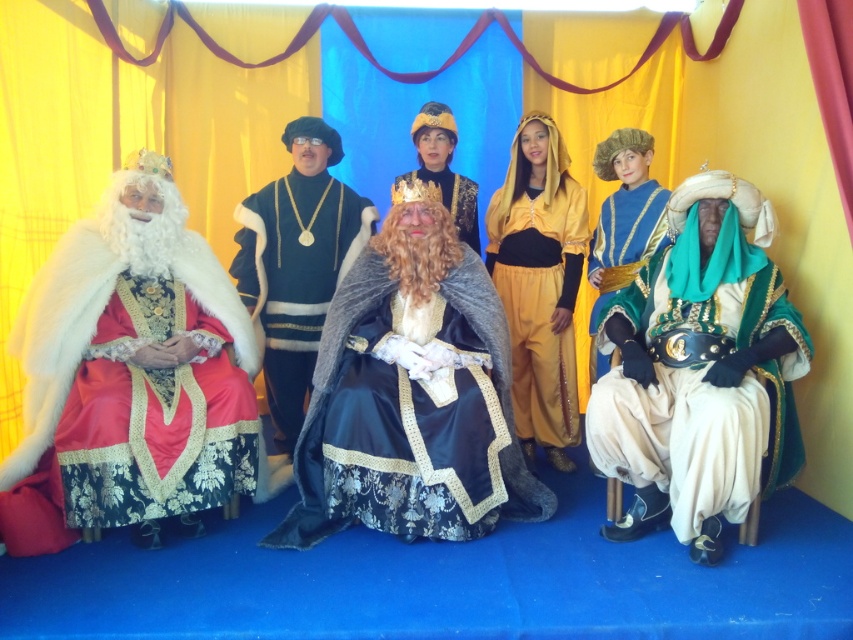
You are a photographer setting up for a photo shoot of the Three Wise Men and Santa. You need to ensure that all headpieces are visible in the photo. Given that the velvet green turban at right and the gold metallic crown at center are the two main headpieces, which one might require more space in the frame to capture its full detail?

The velvet green turban at right is bigger than the gold metallic crown at center, so it requires more space in the frame to capture its full detail.